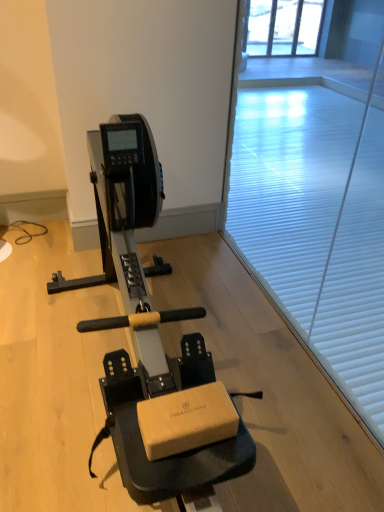
In order to face white matte window screen at center, should I rotate leftwards or rightwards?

You should look right and rotate roughly 14.827 degrees.

What do you see at coordinates (317, 204) in the screenshot? The height and width of the screenshot is (512, 384). I see `white matte window screen at center` at bounding box center [317, 204].

Locate an element on the screen. The image size is (384, 512). white matte window screen at center is located at coordinates (317, 204).

This screenshot has height=512, width=384. Find the location of `matte black stationary bicycle at center`. matte black stationary bicycle at center is located at coordinates (145, 324).

Image resolution: width=384 pixels, height=512 pixels. Describe the element at coordinates (145, 324) in the screenshot. I see `matte black stationary bicycle at center` at that location.

Measure the distance between point (190, 470) and camera.

The depth of point (190, 470) is 38.11 inches.

The image size is (384, 512). I want to click on white matte window screen at center, so click(317, 204).

Does white matte window screen at center appear on the left side of matte black stationary bicycle at center?

No.

Which object is more forward, white matte window screen at center or matte black stationary bicycle at center?

matte black stationary bicycle at center is more forward.

Which point is more forward, (351, 278) or (191, 383)?

The point (191, 383) is in front.

From the image's perspective, between white matte window screen at center and matte black stationary bicycle at center, who is located below?

matte black stationary bicycle at center, from the image's perspective.

From a real-world perspective, between white matte window screen at center and matte black stationary bicycle at center, who is vertically higher?

From a 3D spatial view, white matte window screen at center is above.

Is white matte window screen at center thinner than matte black stationary bicycle at center?

Correct, the width of white matte window screen at center is less than that of matte black stationary bicycle at center.

Between white matte window screen at center and matte black stationary bicycle at center, which one has more height?

With more height is white matte window screen at center.

Considering the relative sizes of white matte window screen at center and matte black stationary bicycle at center in the image provided, is white matte window screen at center smaller than matte black stationary bicycle at center?

Indeed, white matte window screen at center has a smaller size compared to matte black stationary bicycle at center.

Is white matte window screen at center spatially inside matte black stationary bicycle at center, or outside of it?

The correct answer is: outside.

From the picture: Is the surface of white matte window screen at center in direct contact with matte black stationary bicycle at center?

No, white matte window screen at center is not with matte black stationary bicycle at center.

Is matte black stationary bicycle at center at the back of white matte window screen at center?

Correct, white matte window screen at center is looking away from matte black stationary bicycle at center.

Can you tell me how much white matte window screen at center and matte black stationary bicycle at center differ in facing direction?

0.553 degrees.

Find the location of a particular element. This screenshot has width=384, height=512. stationary bicycle on the left of the white matte window screen at center is located at coordinates (145, 324).

Which object is positioned more to the right, matte black stationary bicycle at center or white matte window screen at center?

white matte window screen at center.

In the image, is matte black stationary bicycle at center positioned in front of or behind white matte window screen at center?

matte black stationary bicycle at center is positioned closer to the viewer than white matte window screen at center.

Does point (240, 452) come in front of point (308, 302)?

That is True.

From the image's perspective, which object appears higher, matte black stationary bicycle at center or white matte window screen at center?

white matte window screen at center appears higher in the image.

From a real-world perspective, does matte black stationary bicycle at center sit lower than white matte window screen at center?

Yes.

Between matte black stationary bicycle at center and white matte window screen at center, which one has smaller width?

With smaller width is white matte window screen at center.

Considering the relative sizes of matte black stationary bicycle at center and white matte window screen at center in the image provided, is matte black stationary bicycle at center taller than white matte window screen at center?

Incorrect, the height of matte black stationary bicycle at center is not larger of that of white matte window screen at center.

From the picture: Is matte black stationary bicycle at center bigger or smaller than white matte window screen at center?

matte black stationary bicycle at center is bigger than white matte window screen at center.

In the scene shown: Is white matte window screen at center completely or partially inside matte black stationary bicycle at center?

No, white matte window screen at center is located outside of matte black stationary bicycle at center.

Are matte black stationary bicycle at center and white matte window screen at center making contact?

No, matte black stationary bicycle at center is not with white matte window screen at center.

Is matte black stationary bicycle at center aimed at white matte window screen at center?

Yes, matte black stationary bicycle at center faces towards white matte window screen at center.

How distant is matte black stationary bicycle at center from white matte window screen at center?

matte black stationary bicycle at center and white matte window screen at center are 35.88 inches apart from each other.

I want to click on window screen on the right of matte black stationary bicycle at center, so click(317, 204).

What are the coordinates of `stationary bicycle below the white matte window screen at center (from the image's perspective)` in the screenshot? It's located at (145, 324).

You are a GUI agent. You are given a task and a screenshot of the screen. Output one action in this format:
    pyautogui.click(x=<x>, y=<y>)
    Task: Click on the window screen that appears above the matte black stationary bicycle at center (from a real-world perspective)
    This screenshot has width=384, height=512.
    Given the screenshot: What is the action you would take?
    pyautogui.click(x=317, y=204)